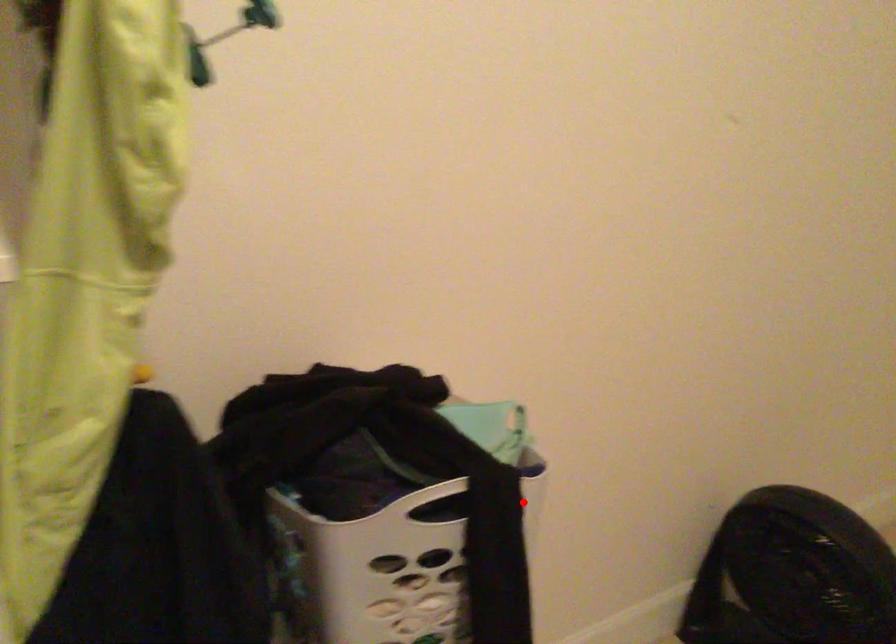
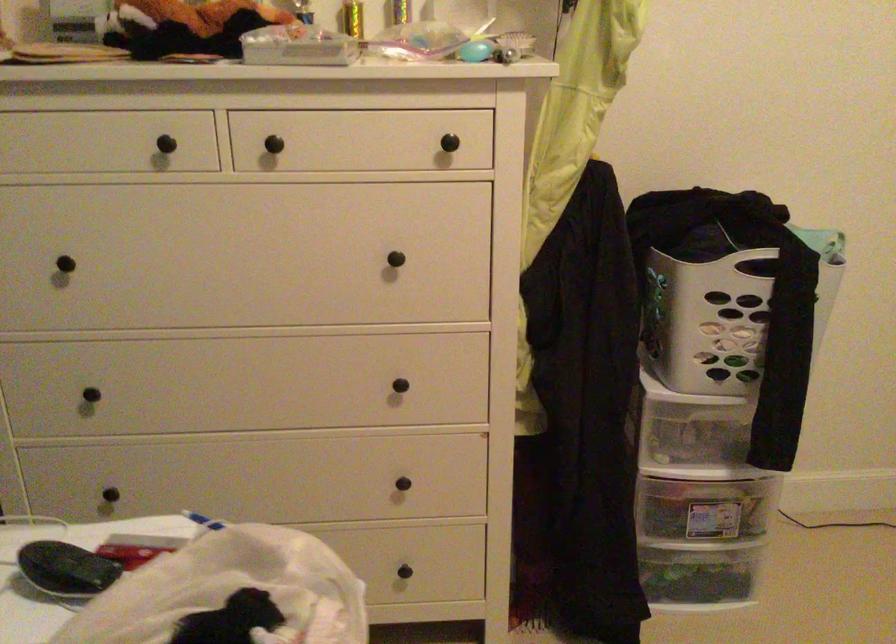
Where in the second image is the point corresponding to the highlighted location from the first image?

(829, 277)